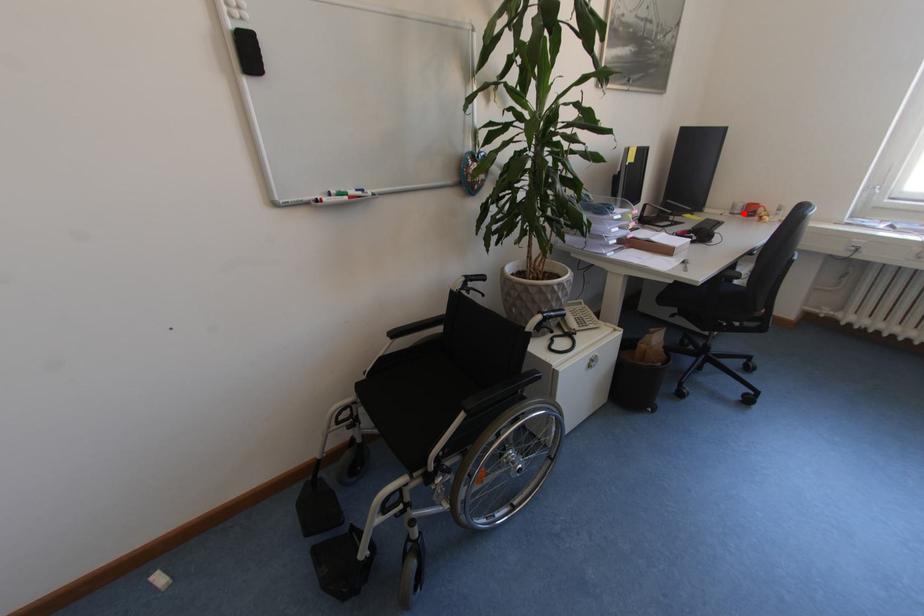
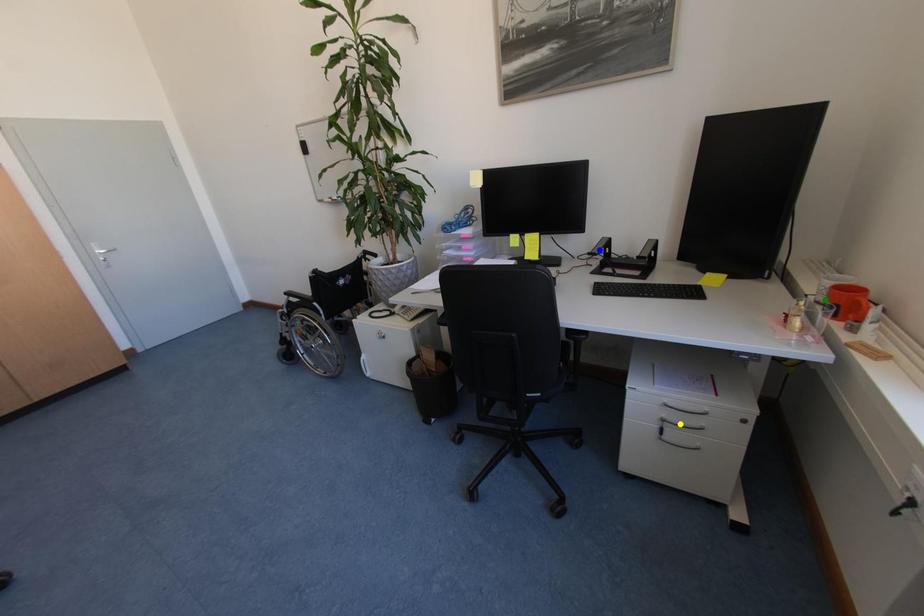
Question: I am providing you with two images of the same scene from different viewpoints. A red point is marked on the first image. You are given multiple points on the second image. Which spot in image 2 lines up with the point in image 1?

Choices:
 (A) blue point
 (B) yellow point
 (C) green point

Answer: (C)